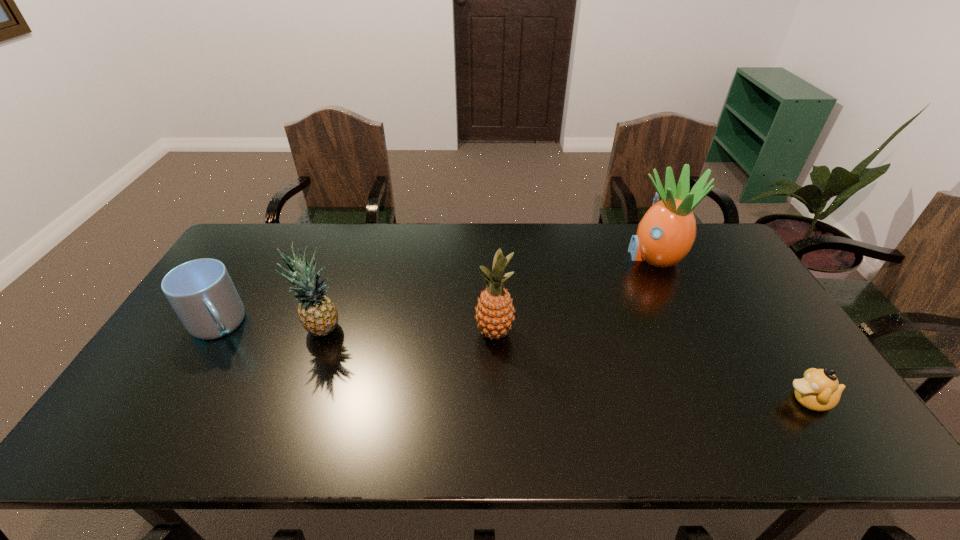
Locate an element on the screen. Image resolution: width=960 pixels, height=540 pixels. free space that is in between the fourth object from right to left and the third object from right to left is located at coordinates (408, 332).

Identify the location of free area in between the third object from right to left and the leftmost pineapple. (408, 332).

Where is `free space between the fourth object from right to left and the nearest object`? The height and width of the screenshot is (540, 960). free space between the fourth object from right to left and the nearest object is located at coordinates click(x=565, y=366).

Select which object appears as the closest to the mug. Please provide its 2D coordinates. Your answer should be formatted as a tuple, i.e. [(x, y)], where the tuple contains the x and y coordinates of a point satisfying the conditions above.

[(317, 313)]

This screenshot has width=960, height=540. I want to click on the closest object to the second object from left to right, so click(x=201, y=292).

Where is `pineapple object that ranks as the second closest to the fourth object from right to left`? The width and height of the screenshot is (960, 540). pineapple object that ranks as the second closest to the fourth object from right to left is located at coordinates (665, 235).

The image size is (960, 540). I want to click on pineapple that is the second closest to the second pineapple from right to left, so click(x=665, y=235).

The image size is (960, 540). Identify the location of vacant area in the image that satisfies the following two spatial constraints: 1. on the front side of the second object from left to right; 2. on the left side of the second pineapple from right to left. pos(322,333).

At what (x,y) coordinates should I click in order to perform the action: click on vacant region that satisfies the following two spatial constraints: 1. on the front side of the third object from right to left; 2. on the right side of the fourth object from right to left. Please return your answer as a coordinate pair (x, y). The image size is (960, 540). Looking at the image, I should click on (322, 333).

This screenshot has width=960, height=540. I want to click on vacant position in the image that satisfies the following two spatial constraints: 1. at the entrance of the rightmost pineapple; 2. on the front side of the third object from right to left, so click(691, 333).